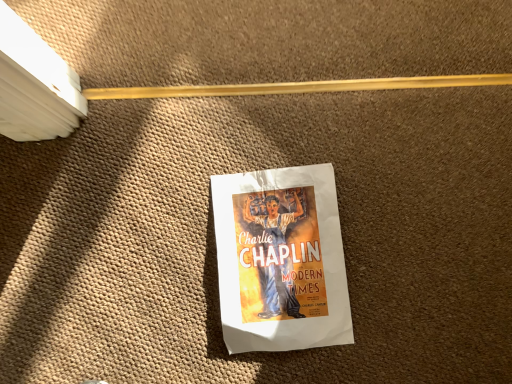
This screenshot has width=512, height=384. Identify the location of free spot behind white paper poster at center. (274, 113).